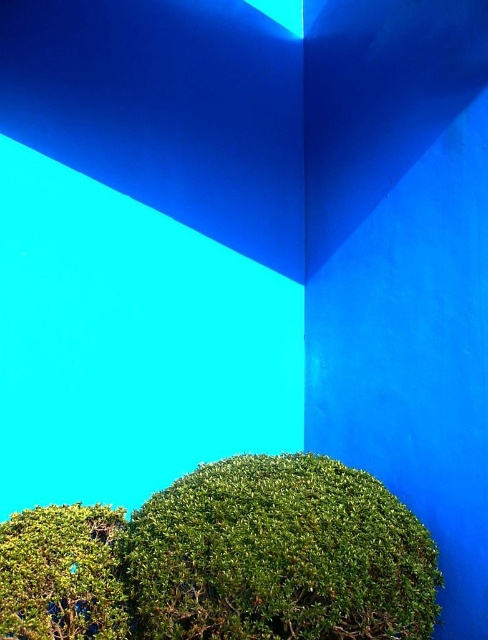
The image size is (488, 640). In order to click on green matte bush at lower center in this screenshot , I will do `click(278, 556)`.

From the picture: Is green matte bush at lower center closer to camera compared to green matte bush at lower left?

No, green matte bush at lower center is further to the viewer.

What do you see at coordinates (278, 556) in the screenshot?
I see `green matte bush at lower center` at bounding box center [278, 556].

I want to click on green matte bush at lower center, so click(x=278, y=556).